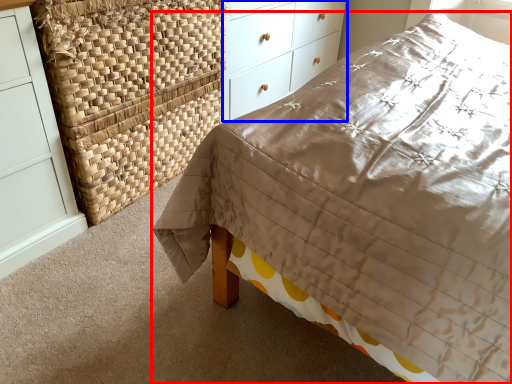
Question: Which object appears closest to the camera in this image, bed (highlighted by a red box) or chest of drawers (highlighted by a blue box)?

Choices:
 (A) bed
 (B) chest of drawers

Answer: (A)